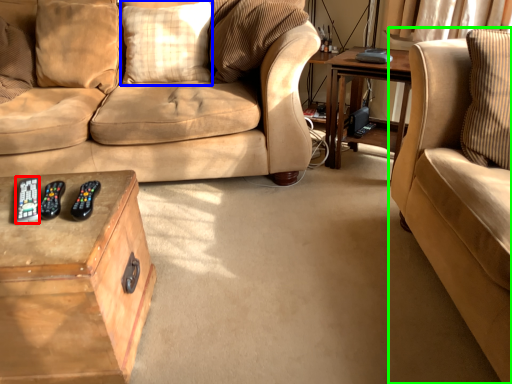
Question: Which object is the closest to the remote (highlighted by a red box)? Choose among these: pillow (highlighted by a blue box) or studio couch (highlighted by a green box).

Choices:
 (A) pillow
 (B) studio couch

Answer: (A)